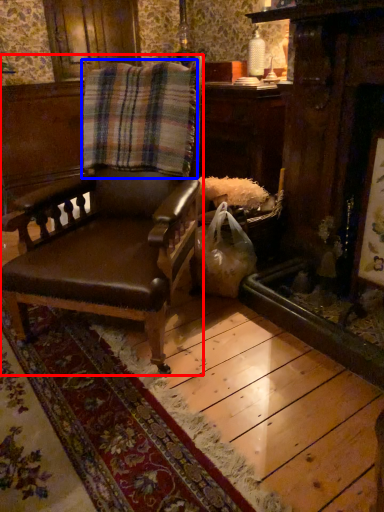
Question: Which of the following is the farthest to the observer, chair (highlighted by a red box) or blanket (highlighted by a blue box)?

Choices:
 (A) chair
 (B) blanket

Answer: (B)